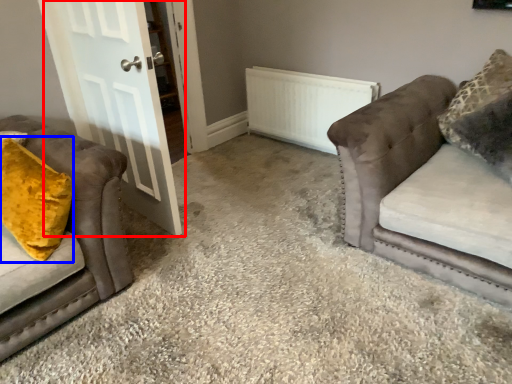
Question: Which object appears closest to the camera in this image, door (highlighted by a red box) or throw pillow (highlighted by a blue box)?

Choices:
 (A) door
 (B) throw pillow

Answer: (B)